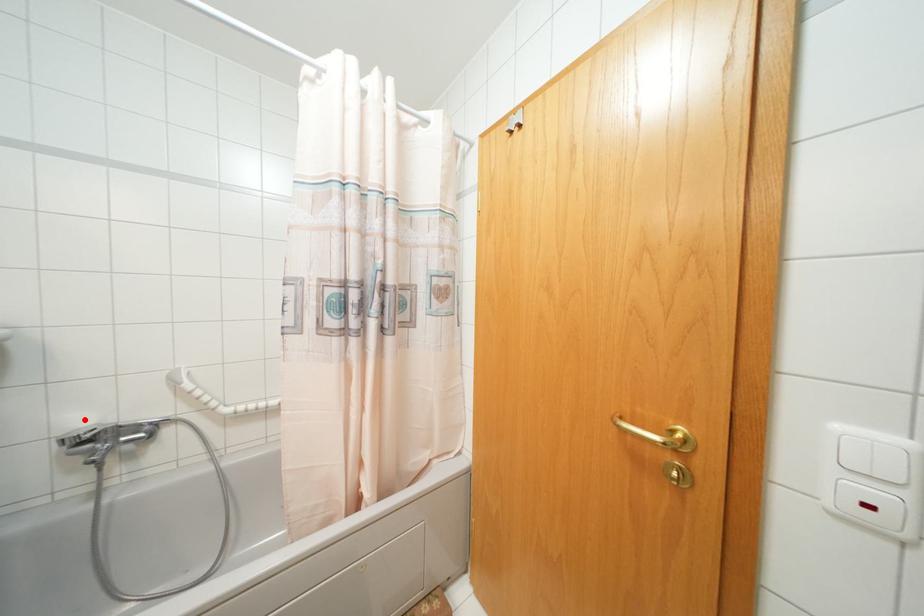
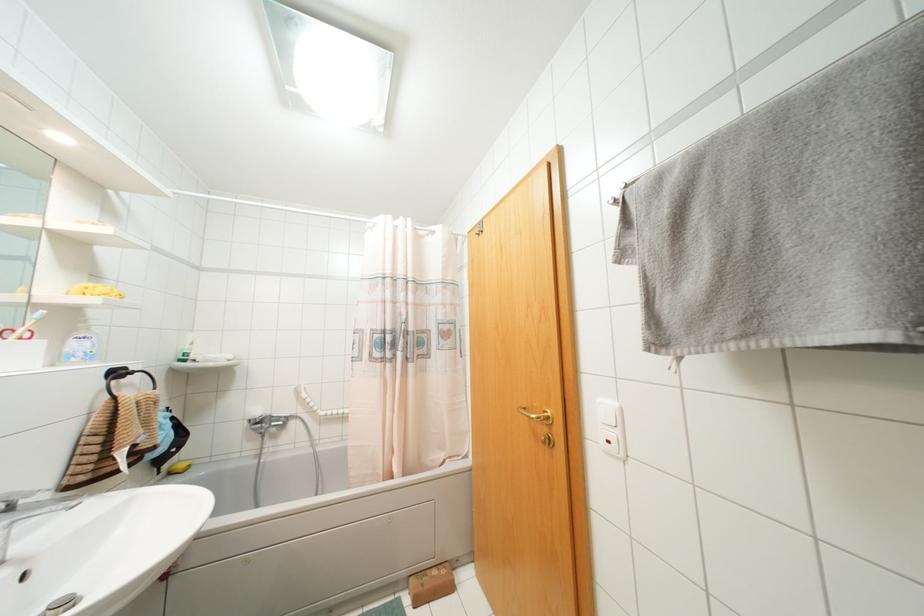
Question: I am providing you with two images of the same scene from different viewpoints. Image1 has a red point marked. In image2, the corresponding 3D location appears at what relative position? Reply with the corresponding letter.

Choices:
 (A) Closer
 (B) Farther

Answer: (B)